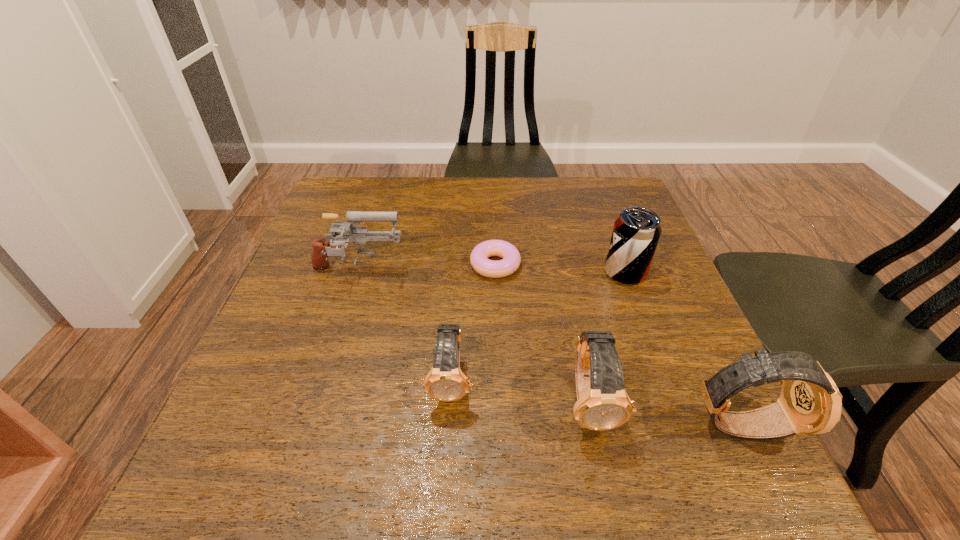
In order to click on the second shortest object in this screenshot , I will do [x=446, y=382].

I want to click on the shortest watch, so click(446, 382).

This screenshot has width=960, height=540. In order to click on the second watch from left to right in this screenshot , I will do point(602,403).

Identify the location of the second shortest watch. This screenshot has width=960, height=540. (602, 403).

In order to click on the rightmost watch in this screenshot , I will do `click(810, 403)`.

Image resolution: width=960 pixels, height=540 pixels. What are the coordinates of `the leftmost object` in the screenshot? It's located at (359, 235).

You are a GUI agent. You are given a task and a screenshot of the screen. Output one action in this format:
    pyautogui.click(x=<x>, y=<y>)
    Task: Click on the shortest object
    The width and height of the screenshot is (960, 540).
    Given the screenshot: What is the action you would take?
    pyautogui.click(x=479, y=260)

You are a GUI agent. You are given a task and a screenshot of the screen. Output one action in this format:
    pyautogui.click(x=<x>, y=<y>)
    Task: Click on the soda can
    The width and height of the screenshot is (960, 540).
    Given the screenshot: What is the action you would take?
    pyautogui.click(x=636, y=232)

Where is `free spot located 0.080m at the barrel end of the leftmost object`? The height and width of the screenshot is (540, 960). free spot located 0.080m at the barrel end of the leftmost object is located at coordinates (438, 272).

Identify the location of vacant space located on the front of the shortest object. (500, 390).